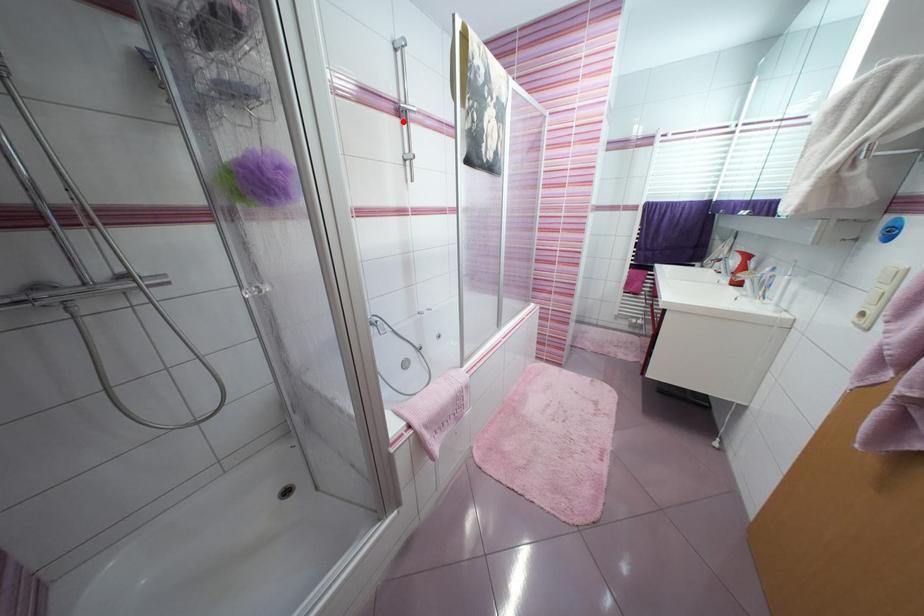
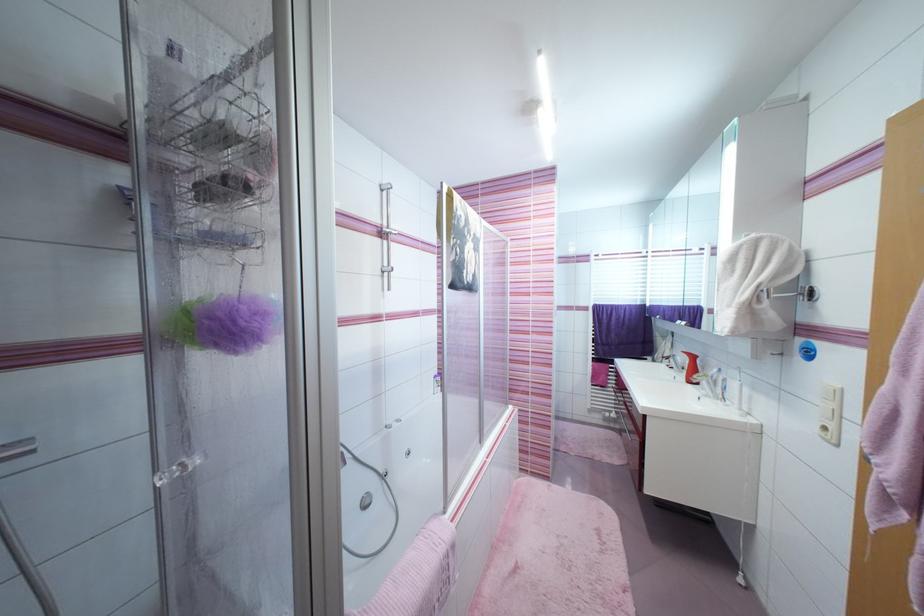
Question: I am providing you with two images of the same scene from different viewpoints. A red point is marked on the first image. Is the red point's position out of view in image 2?

Choices:
 (A) Yes
 (B) No

Answer: (B)